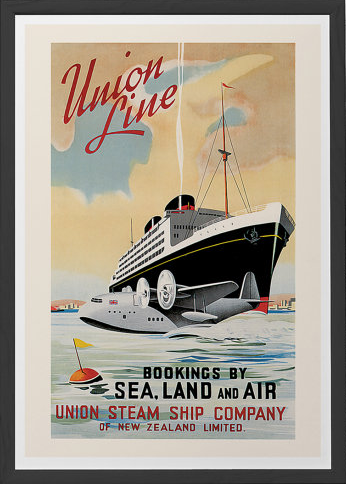
The height and width of the screenshot is (484, 346). What are the coordinates of `poster` in the screenshot? It's located at (169, 154).